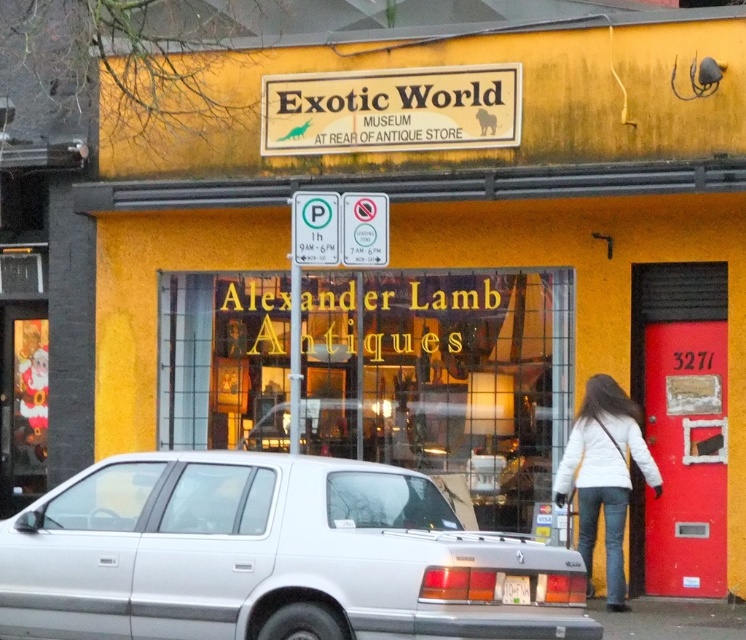
Does white matte jacket at lower right appear under white plastic license plate at rear?

Actually, white matte jacket at lower right is above white plastic license plate at rear.

Is point (623, 520) positioned after point (527, 589)?

Yes, point (623, 520) is behind point (527, 589).

The height and width of the screenshot is (640, 746). I want to click on white matte jacket at lower right, so click(604, 476).

Can you confirm if silver metallic sedan at lower center is wider than white plastic license plate at rear?

Correct, the width of silver metallic sedan at lower center exceeds that of white plastic license plate at rear.

Image resolution: width=746 pixels, height=640 pixels. What do you see at coordinates (269, 556) in the screenshot? I see `silver metallic sedan at lower center` at bounding box center [269, 556].

Image resolution: width=746 pixels, height=640 pixels. Find the location of `silver metallic sedan at lower center`. silver metallic sedan at lower center is located at coordinates [269, 556].

Does silver metallic sedan at lower center have a smaller size compared to white matte jacket at lower right?

No.

Which is behind, point (119, 611) or point (633, 404)?

Positioned behind is point (633, 404).

At what (x,y) coordinates should I click in order to perform the action: click on silver metallic sedan at lower center. Please return your answer as a coordinate pair (x, y). Looking at the image, I should click on (269, 556).